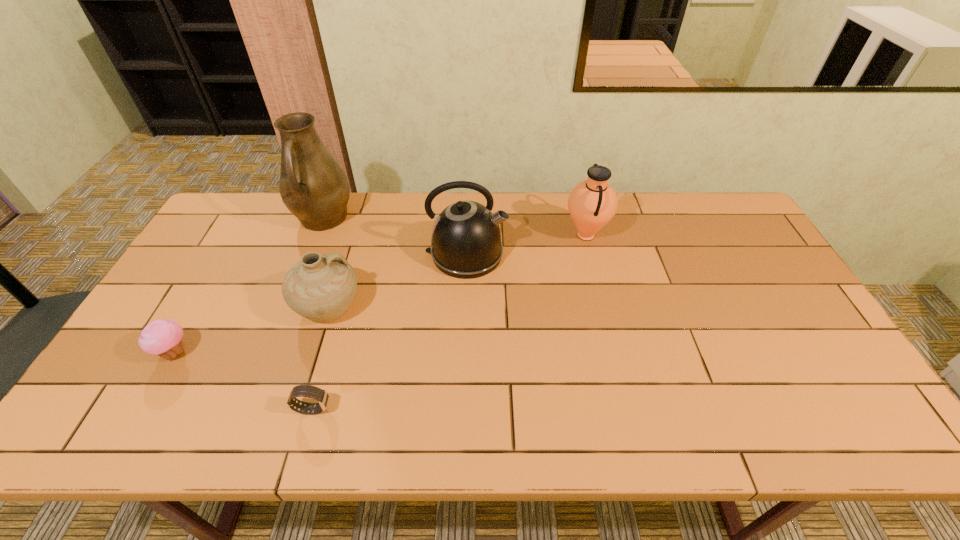
Locate an element on the screen. free spot at the far edge of the desktop is located at coordinates (x=550, y=206).

In the image, there is a desktop. What are the coordinates of `vacant space at the near edge` in the screenshot? It's located at (220, 422).

Locate an element on the screen. The width and height of the screenshot is (960, 540). free space at the left edge of the desktop is located at coordinates (168, 319).

I want to click on empty space that is in between the kettle and the taller pitcher, so click(395, 237).

At what (x,y) coordinates should I click in order to perform the action: click on vacant area that lies between the rightmost object and the second nearest object. Please return your answer as a coordinate pair (x, y). Image resolution: width=960 pixels, height=540 pixels. Looking at the image, I should click on (380, 294).

Identify the location of vacant region between the third shortest object and the fifth farthest object. (252, 329).

Where is `free space between the shortest object and the pottery`? The height and width of the screenshot is (540, 960). free space between the shortest object and the pottery is located at coordinates tap(321, 357).

The height and width of the screenshot is (540, 960). Find the location of `free space between the taller pitcher and the cupcake`. free space between the taller pitcher and the cupcake is located at coordinates (249, 286).

Select which object appears as the fifth closest to the fifth object from left to right. Please provide its 2D coordinates. Your answer should be formatted as a tuple, i.e. [(x, y)], where the tuple contains the x and y coordinates of a point satisfying the conditions above.

[(163, 337)]

Find the location of a particular element. object that is the third closest one to the right pitcher is located at coordinates (313, 186).